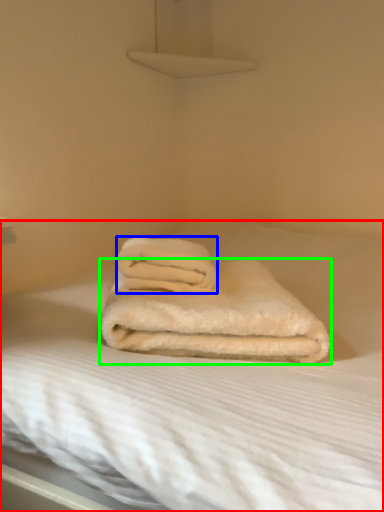
Question: Estimate the real-world distances between objects in this image. Which object is farther from bed (highlighted by a red box), towel (highlighted by a blue box) or towel (highlighted by a green box)?

Choices:
 (A) towel
 (B) towel

Answer: (A)